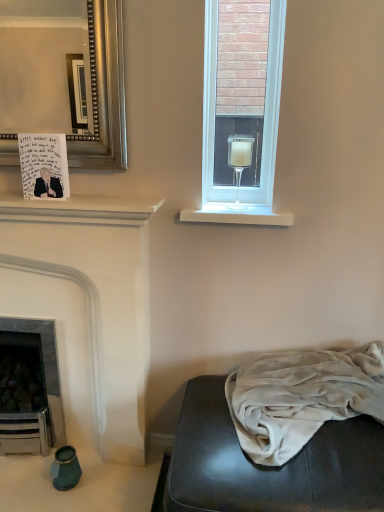
Question: From the image's perspective, is white matte fireplace at left on top of handwritten paper postcard at upper left?

Choices:
 (A) no
 (B) yes

Answer: (A)

Question: From the image's perspective, is white matte fireplace at left below handwritten paper postcard at upper left?

Choices:
 (A) yes
 (B) no

Answer: (A)

Question: Can you confirm if white matte fireplace at left is positioned to the right of handwritten paper postcard at upper left?

Choices:
 (A) no
 (B) yes

Answer: (A)

Question: Can you confirm if white matte fireplace at left is shorter than handwritten paper postcard at upper left?

Choices:
 (A) no
 (B) yes

Answer: (A)

Question: Considering the relative sizes of white matte fireplace at left and handwritten paper postcard at upper left in the image provided, is white matte fireplace at left smaller than handwritten paper postcard at upper left?

Choices:
 (A) yes
 (B) no

Answer: (B)

Question: Do you think clear glass wine glass at upper right is within handwritten paper postcard at upper left, or outside of it?

Choices:
 (A) inside
 (B) outside

Answer: (B)

Question: In terms of height, does clear glass wine glass at upper right look taller or shorter compared to handwritten paper postcard at upper left?

Choices:
 (A) short
 (B) tall

Answer: (B)

Question: Looking at their shapes, would you say clear glass wine glass at upper right is wider or thinner than handwritten paper postcard at upper left?

Choices:
 (A) thin
 (B) wide

Answer: (B)

Question: Considering the positions of clear glass wine glass at upper right and handwritten paper postcard at upper left in the image, is clear glass wine glass at upper right bigger or smaller than handwritten paper postcard at upper left?

Choices:
 (A) small
 (B) big

Answer: (B)

Question: Is white matte shelf at upper left spatially inside white smooth window sill at upper right, or outside of it?

Choices:
 (A) inside
 (B) outside

Answer: (B)

Question: From the image's perspective, relative to white smooth window sill at upper right, is white matte shelf at upper left above or below?

Choices:
 (A) above
 (B) below

Answer: (A)

Question: Considering the positions of white matte shelf at upper left and white smooth window sill at upper right in the image, is white matte shelf at upper left taller or shorter than white smooth window sill at upper right?

Choices:
 (A) short
 (B) tall

Answer: (A)

Question: In the image, is white matte shelf at upper left positioned in front of or behind white smooth window sill at upper right?

Choices:
 (A) front
 (B) behind

Answer: (A)

Question: Relative to velvet gray studio couch at lower right, is clear glass candle at upper center in front or behind?

Choices:
 (A) front
 (B) behind

Answer: (B)

Question: Is clear glass candle at upper center situated inside velvet gray studio couch at lower right or outside?

Choices:
 (A) outside
 (B) inside

Answer: (A)